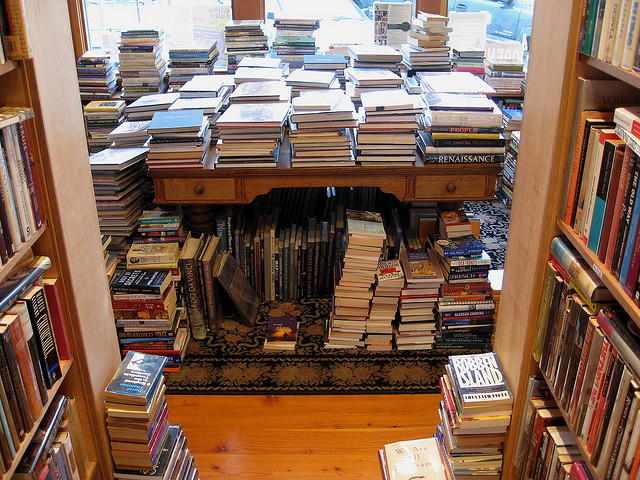
The height and width of the screenshot is (480, 640). What are the coordinates of `floorug` in the screenshot? It's located at (285, 450), (272, 374).